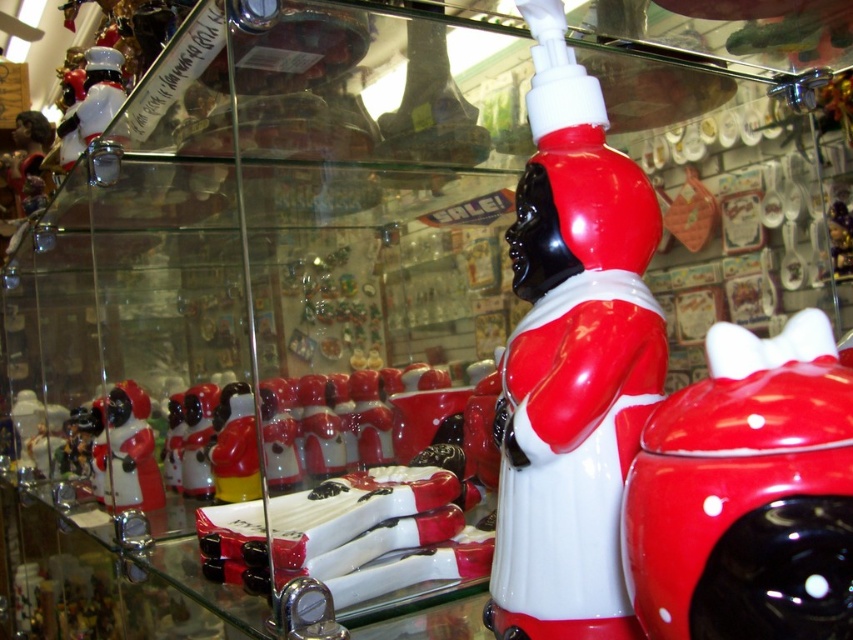
Which is behind, point (622, 244) or point (844, 632)?

Positioned behind is point (622, 244).

Which is in front, point (543, 608) or point (834, 602)?

Point (834, 602) is in front.

Where is `shiny ceramic santa at center`? This screenshot has height=640, width=853. shiny ceramic santa at center is located at coordinates (572, 358).

Is matte plastic figurine at left positioned in front of shiny silver figurine at upper left?

Yes.

Between matte plastic figurine at left and shiny silver figurine at upper left, which one is positioned higher?

shiny silver figurine at upper left is above.

Between point (131, 404) and point (86, 60), which one is positioned behind?

The point (131, 404) is more distant.

At what (x,y) coordinates should I click in order to perform the action: click on matte plastic figurine at left. Please return your answer as a coordinate pair (x, y). Looking at the image, I should click on (126, 451).

Does point (505, 380) lie in front of point (90, 97)?

Yes, it is in front of point (90, 97).

Which is more to the left, shiny ceramic santa at center or shiny silver figurine at upper left?

From the viewer's perspective, shiny silver figurine at upper left appears more on the left side.

The image size is (853, 640). Describe the element at coordinates (572, 358) in the screenshot. I see `shiny ceramic santa at center` at that location.

Find the location of `shiny ceramic santa at center`. shiny ceramic santa at center is located at coordinates (572, 358).